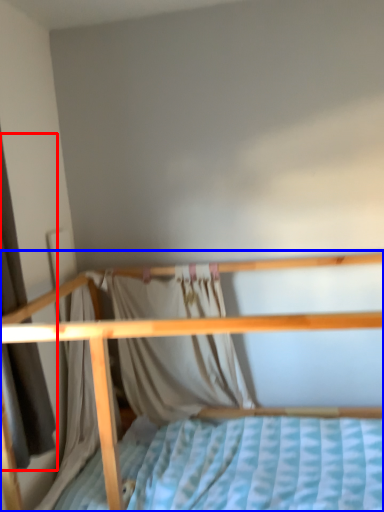
Question: Among these objects, which one is farthest to the camera, curtain (highlighted by a red box) or bed (highlighted by a blue box)?

Choices:
 (A) curtain
 (B) bed

Answer: (A)